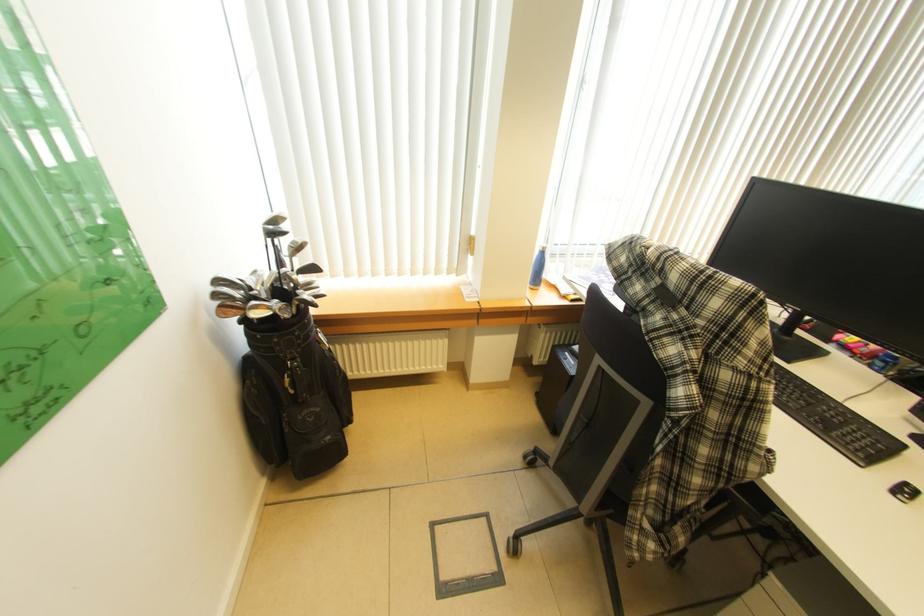
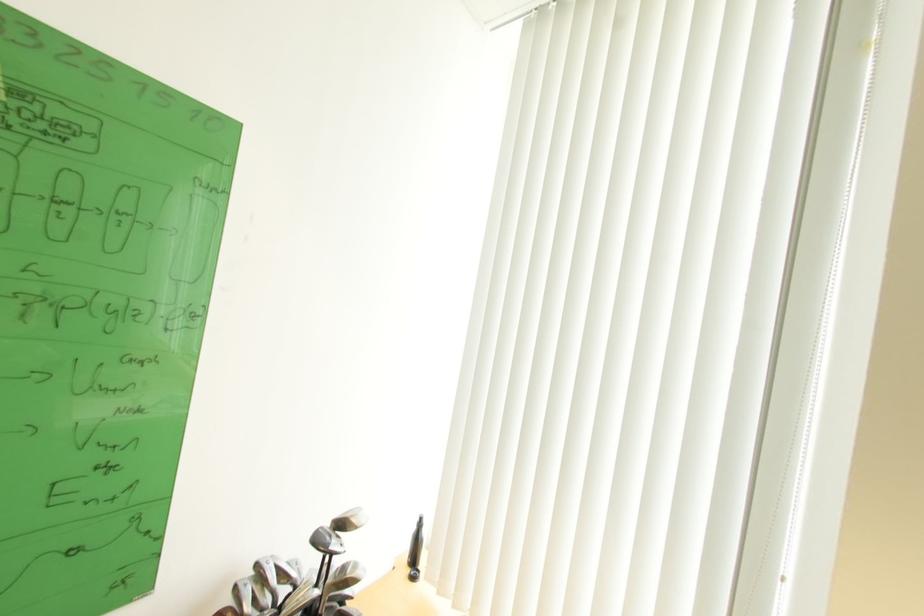
Based on the continuous images, in which direction is the camera rotating?

The camera's rotation is toward left-up.